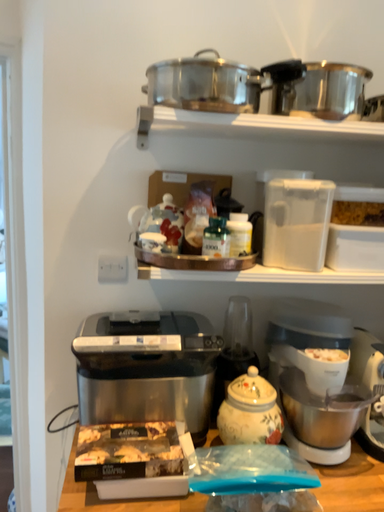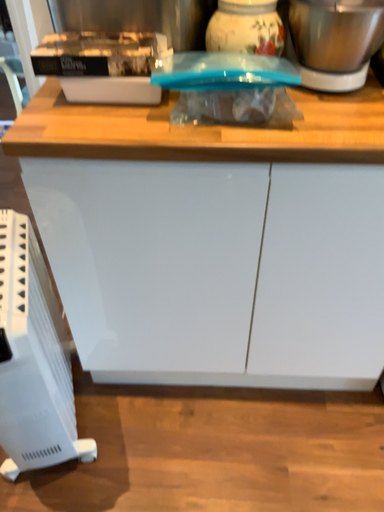
Question: Which way did the camera rotate in the video?

Choices:
 (A) rotated right
 (B) rotated left

Answer: (B)